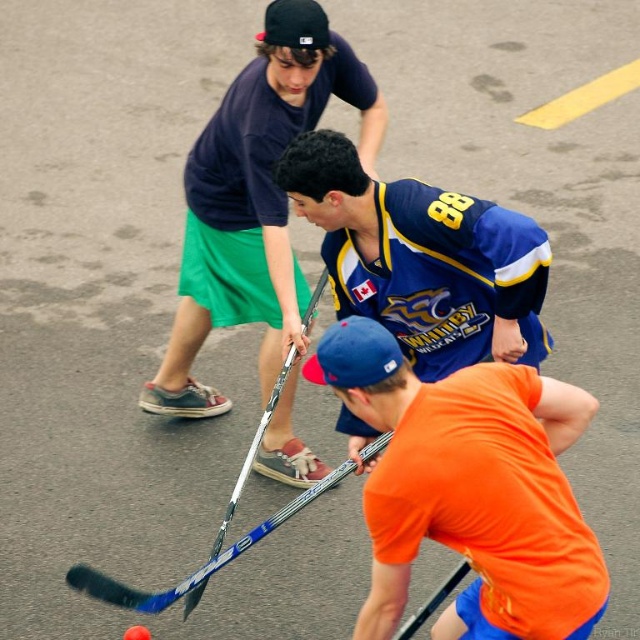
Question: Which of the following is the farthest from the observer?

Choices:
 (A) matte black hockey stick at center
 (B) orange matte hockey stick at lower center

Answer: (A)

Question: Which point appears closest to the camera in this image?

Choices:
 (A) (195, 280)
 (B) (417, 408)

Answer: (B)

Question: Does orange matte hockey stick at lower center come behind matte black hockey stick at center?

Choices:
 (A) yes
 (B) no

Answer: (B)

Question: Which of the following is the farthest from the observer?

Choices:
 (A) (266, 392)
 (B) (566, 620)

Answer: (A)

Question: Is orange matte hockey stick at lower center positioned at the back of matte black hockey stick at center?

Choices:
 (A) yes
 (B) no

Answer: (B)

Question: Considering the relative positions of orange matte hockey stick at lower center and matte black hockey stick at center in the image provided, where is orange matte hockey stick at lower center located with respect to matte black hockey stick at center?

Choices:
 (A) left
 (B) right

Answer: (B)